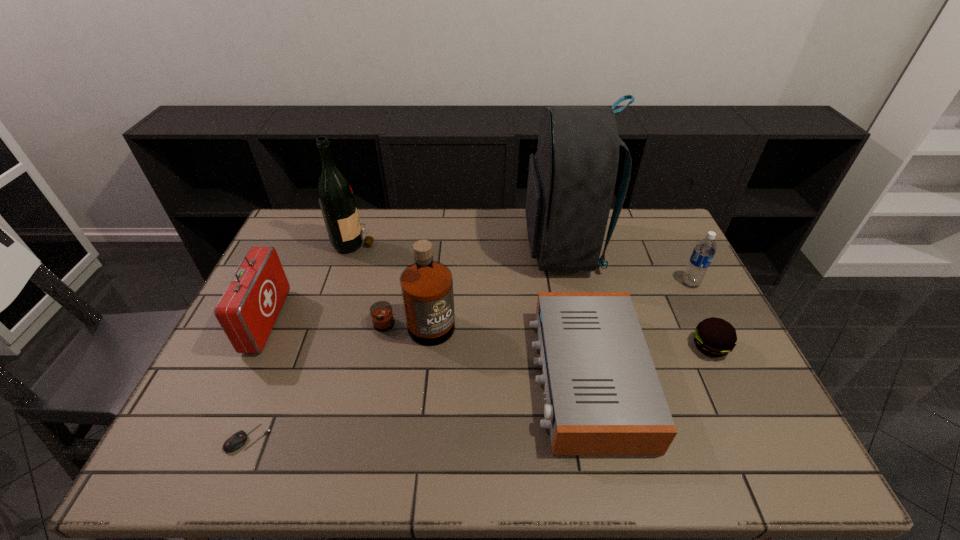
You are a GUI agent. You are given a task and a screenshot of the screen. Output one action in this format:
    pyautogui.click(x=<x>, y=<y>)
    Task: Click on the tallest object
    
    Given the screenshot: What is the action you would take?
    pyautogui.click(x=571, y=179)

I want to click on the seventh shortest object, so [335, 195].

At what (x,y) coordinates should I click in order to perform the action: click on the fourth object from left to right. Please return your answer as a coordinate pair (x, y). The height and width of the screenshot is (540, 960). Looking at the image, I should click on (426, 286).

The height and width of the screenshot is (540, 960). Find the location of `the sixth shortest object`. the sixth shortest object is located at coordinates (426, 286).

This screenshot has width=960, height=540. Find the location of `the first-aid kit`. the first-aid kit is located at coordinates (248, 309).

Locate an element on the screen. This screenshot has height=540, width=960. water bottle is located at coordinates (704, 251).

This screenshot has width=960, height=540. I want to click on the sixth tallest object, so click(x=603, y=396).

Where is `the seventh tallest object`? The height and width of the screenshot is (540, 960). the seventh tallest object is located at coordinates (714, 337).

The height and width of the screenshot is (540, 960). Find the location of `mouse`. mouse is located at coordinates (236, 441).

This screenshot has height=540, width=960. Identify the location of vacant point located on the front-facing side of the backpack. [466, 248].